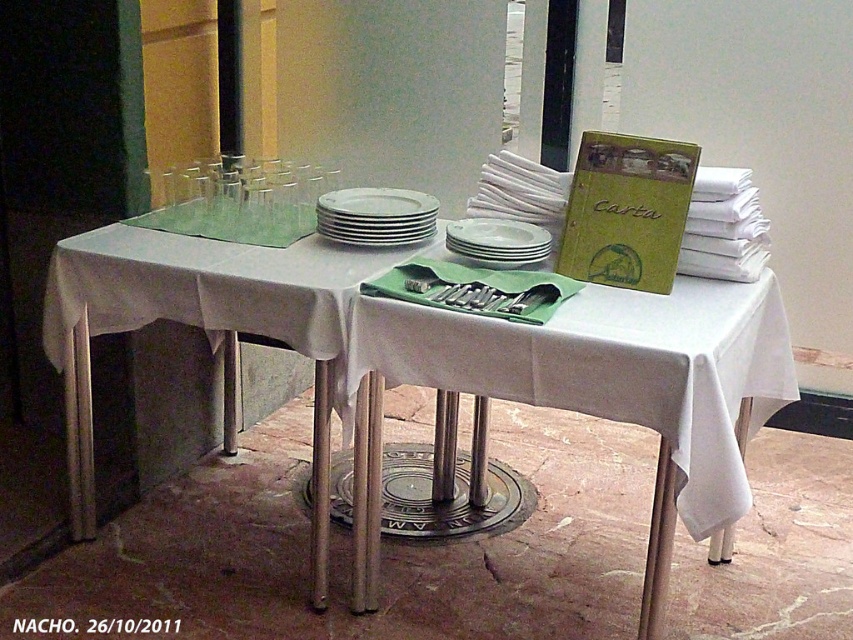
Which is more to the left, white cloth table at center or white matte plate at center?

white matte plate at center

Who is lower down, white cloth table at center or white matte plate at center?

Positioned lower is white cloth table at center.

Does point (700, 412) lie in front of point (538, 236)?

Yes, it is in front of point (538, 236).

At what (x,y) coordinates should I click in order to perform the action: click on white cloth table at center. Please return your answer as a coordinate pair (x, y). The height and width of the screenshot is (640, 853). Looking at the image, I should click on (616, 384).

Is white cloth table at center positioned in front of white glossy plates at center?

Yes, white cloth table at center is in front of white glossy plates at center.

Between point (630, 356) and point (425, 209), which one is positioned in front?

Point (630, 356) is more forward.

Image resolution: width=853 pixels, height=640 pixels. I want to click on white cloth table at center, so click(616, 384).

This screenshot has height=640, width=853. Describe the element at coordinates (376, 216) in the screenshot. I see `white glossy plates at center` at that location.

Can you confirm if white glossy plates at center is wider than white matte plate at center?

Correct, the width of white glossy plates at center exceeds that of white matte plate at center.

Between point (352, 195) and point (473, 250), which one is positioned behind?

The point (352, 195) is more distant.

I want to click on white glossy plates at center, so click(x=376, y=216).